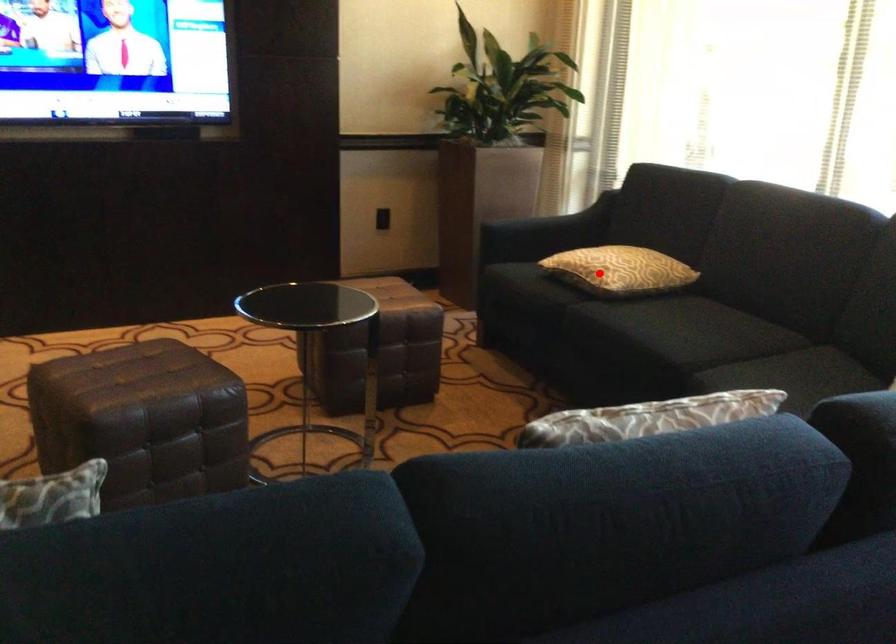
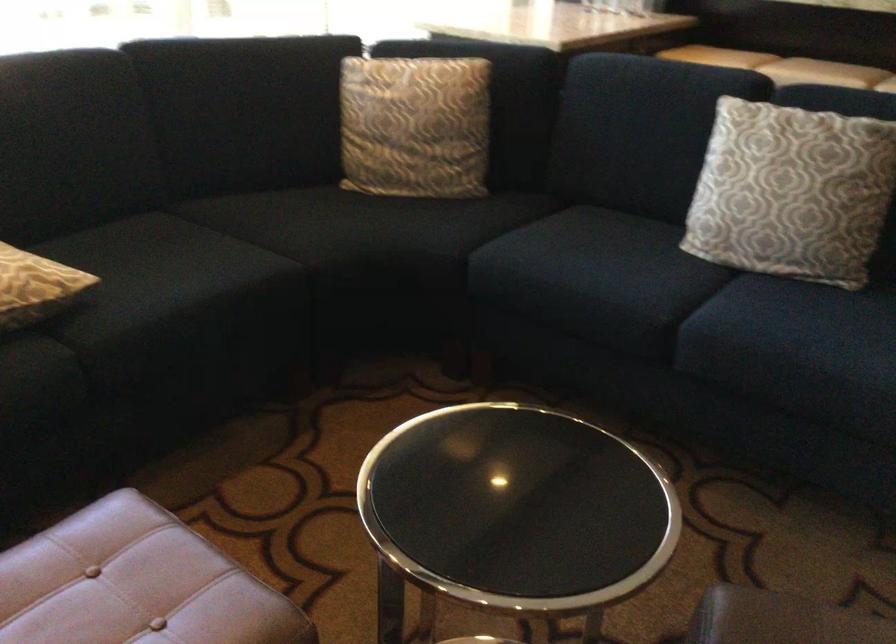
Question: I am providing you with two images of the same scene from different viewpoints. In image1, a red point is highlighted. Considering the same 3D point in image2, which of the following is correct?

Choices:
 (A) It is closer
 (B) It is farther

Answer: (A)